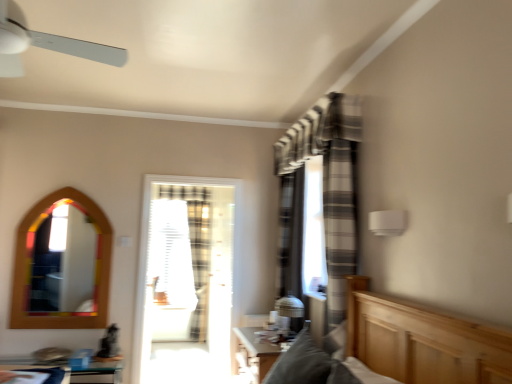
Question: Is white plastic ceiling fan at upper left inside the boundaries of clear plastic screen at center, or outside?

Choices:
 (A) outside
 (B) inside

Answer: (A)

Question: From the image's perspective, is white plastic ceiling fan at upper left above or below clear plastic screen at center?

Choices:
 (A) above
 (B) below

Answer: (A)

Question: Based on their relative distances, which object is farther from the wooden table at lower center, which is counted as the 2th table, starting from the left?

Choices:
 (A) wooden mirror at left
 (B) gray striped curtain at center
 (C) clear glass table at lower left, positioned as the first table in left-to-right order
 (D) clear plastic screen at center
 (E) white plastic ceiling fan at upper left

Answer: (E)

Question: Which is farther from the clear plastic screen at center?

Choices:
 (A) translucent glass door at center
 (B) clear glass table at lower left, acting as the 2th table starting from the right
 (C) wooden table at lower center, the first table positioned from the right
 (D) wooden mirror at left
 (E) white plastic ceiling fan at upper left

Answer: (E)